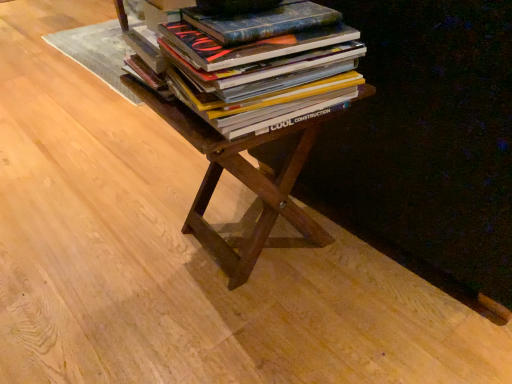
Question: Would you say brown wood table at center contains hardcover books at center?

Choices:
 (A) no
 (B) yes

Answer: (A)

Question: Is brown wood table at center placed right next to hardcover books at center?

Choices:
 (A) no
 (B) yes

Answer: (A)

Question: Is brown wood table at center in front of hardcover books at center?

Choices:
 (A) no
 (B) yes

Answer: (A)

Question: From a real-world perspective, is brown wood table at center below hardcover books at center?

Choices:
 (A) no
 (B) yes

Answer: (B)

Question: Is brown wood table at center at the right side of hardcover books at center?

Choices:
 (A) yes
 (B) no

Answer: (B)

Question: Are brown wood table at center and hardcover books at center located far from each other?

Choices:
 (A) yes
 (B) no

Answer: (B)

Question: Can you confirm if hardcover books at center is shorter than brown wood table at center?

Choices:
 (A) yes
 (B) no

Answer: (A)

Question: Is hardcover books at center wider than brown wood table at center?

Choices:
 (A) yes
 (B) no

Answer: (B)

Question: From a real-world perspective, is hardcover books at center located higher than brown wood table at center?

Choices:
 (A) no
 (B) yes

Answer: (B)

Question: Does hardcover books at center lie in front of brown wood table at center?

Choices:
 (A) yes
 (B) no

Answer: (A)

Question: From the image's perspective, is hardcover books at center on brown wood table at center?

Choices:
 (A) yes
 (B) no

Answer: (A)

Question: Is hardcover books at center bigger than brown wood table at center?

Choices:
 (A) no
 (B) yes

Answer: (A)

Question: Is hardcover books at center bigger or smaller than brown wood table at center?

Choices:
 (A) small
 (B) big

Answer: (A)